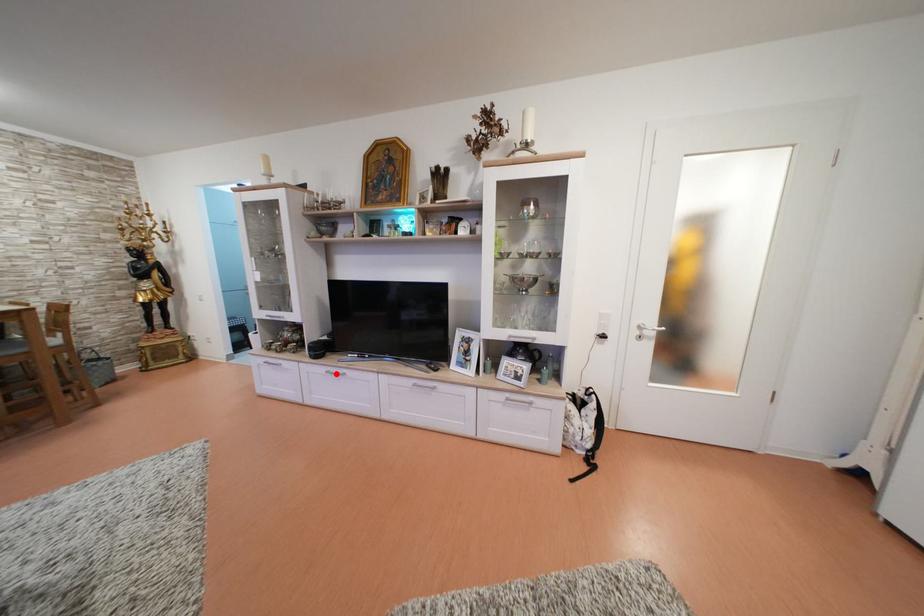
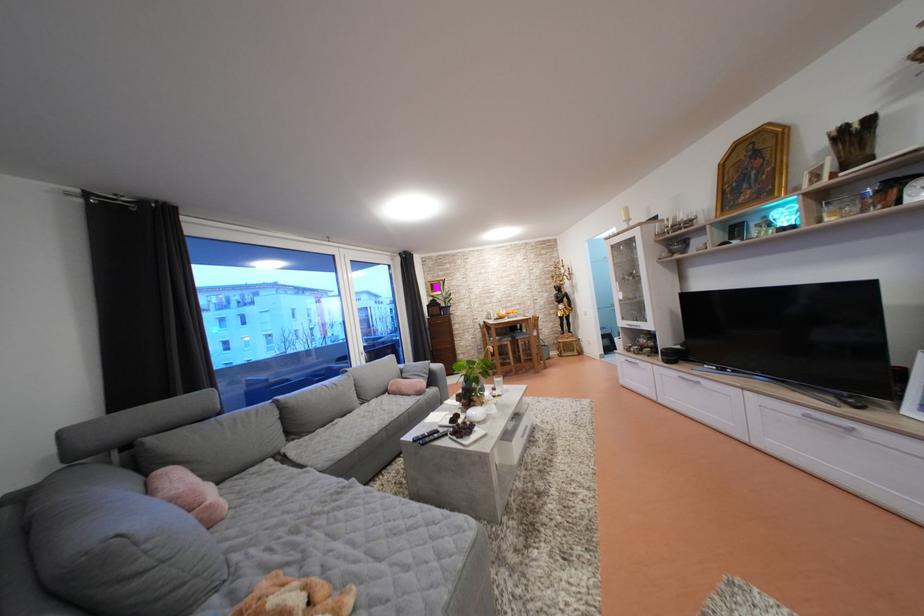
In the second image, find the point that corresponds to the highlighted location in the first image.

(688, 379)